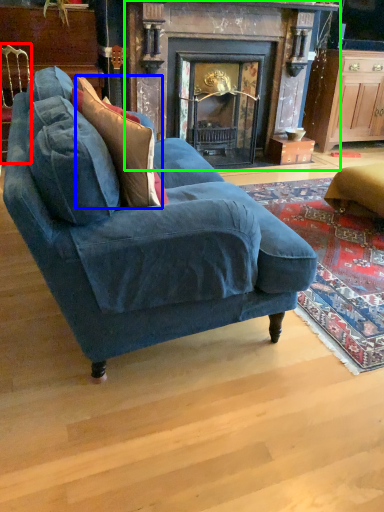
Question: Based on their relative distances, which object is nearer to chair (highlighted by a red box)? Choose from throw pillow (highlighted by a blue box) and fireplace (highlighted by a green box).

Choices:
 (A) throw pillow
 (B) fireplace

Answer: (A)